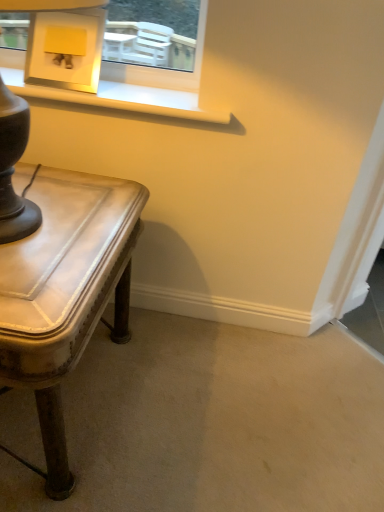
Locate an element on the screen. matte brown table lamp at left is located at coordinates (13, 169).

This screenshot has width=384, height=512. What do you see at coordinates (13, 169) in the screenshot?
I see `matte brown table lamp at left` at bounding box center [13, 169].

In order to click on leather-like table at lower left in this screenshot , I will do `click(65, 292)`.

The image size is (384, 512). What do you see at coordinates (65, 292) in the screenshot? I see `leather-like table at lower left` at bounding box center [65, 292].

This screenshot has width=384, height=512. What are the coordinates of `matte brown table lamp at left` in the screenshot? It's located at (13, 169).

Is leather-like table at lower left to the right of matte brown table lamp at left from the viewer's perspective?

In fact, leather-like table at lower left is to the left of matte brown table lamp at left.

In the image, is leather-like table at lower left positioned in front of or behind matte brown table lamp at left?

In the image, leather-like table at lower left appears behind matte brown table lamp at left.

Does point (42, 378) come in front of point (92, 20)?

Yes.

From the image's perspective, is leather-like table at lower left on matte brown table lamp at left?

Incorrect, from the image's perspective, leather-like table at lower left is lower than matte brown table lamp at left.

From a real-world perspective, between leather-like table at lower left and matte brown table lamp at left, who is vertically lower?

In real-world perspective, leather-like table at lower left is lower.

Considering the relative sizes of leather-like table at lower left and matte brown table lamp at left in the image provided, is leather-like table at lower left thinner than matte brown table lamp at left?

In fact, leather-like table at lower left might be wider than matte brown table lamp at left.

Considering the relative sizes of leather-like table at lower left and matte brown table lamp at left in the image provided, is leather-like table at lower left taller than matte brown table lamp at left?

Yes.

Does leather-like table at lower left have a smaller size compared to matte brown table lamp at left?

Incorrect, leather-like table at lower left is not smaller in size than matte brown table lamp at left.

Do you think leather-like table at lower left is within matte brown table lamp at left, or outside of it?

leather-like table at lower left is not inside matte brown table lamp at left, it's outside.

Would you consider leather-like table at lower left to be distant from matte brown table lamp at left?

They are positioned close to each other.

Could you tell me if leather-like table at lower left is turned towards matte brown table lamp at left?

No, leather-like table at lower left is not aimed at matte brown table lamp at left.

Can you tell me how much leather-like table at lower left and matte brown table lamp at left differ in facing direction?

The facing directions of leather-like table at lower left and matte brown table lamp at left are 7.09e-05 degrees apart.

Measure the distance from leather-like table at lower left to matte brown table lamp at left.

leather-like table at lower left and matte brown table lamp at left are 9.30 inches apart from each other.

At what (x,y) coordinates should I click in order to perform the action: click on table lamp lying on the right of leather-like table at lower left. Please return your answer as a coordinate pair (x, y). The height and width of the screenshot is (512, 384). Looking at the image, I should click on (13, 169).

Does matte brown table lamp at left appear on the right side of leather-like table at lower left?

Yes, matte brown table lamp at left is to the right of leather-like table at lower left.

Is matte brown table lamp at left in front of or behind leather-like table at lower left in the image?

In the image, matte brown table lamp at left appears in front of leather-like table at lower left.

Which is nearer, (x=13, y=154) or (x=118, y=215)?

The point (x=13, y=154) is more forward.

From the image's perspective, is matte brown table lamp at left above or below leather-like table at lower left?

matte brown table lamp at left is situated higher than leather-like table at lower left in the image.

From a real-world perspective, does matte brown table lamp at left sit lower than leather-like table at lower left?

No, from a real-world perspective, matte brown table lamp at left is not under leather-like table at lower left.

Does matte brown table lamp at left have a lesser width compared to leather-like table at lower left?

Yes, matte brown table lamp at left is thinner than leather-like table at lower left.

Between matte brown table lamp at left and leather-like table at lower left, which one has more height?

leather-like table at lower left is taller.

Consider the image. Looking at the image, does matte brown table lamp at left seem bigger or smaller compared to leather-like table at lower left?

matte brown table lamp at left is smaller than leather-like table at lower left.

Would you say matte brown table lamp at left is inside or outside leather-like table at lower left?

matte brown table lamp at left cannot be found inside leather-like table at lower left.

Are matte brown table lamp at left and leather-like table at lower left far apart?

Actually, matte brown table lamp at left and leather-like table at lower left are a little close together.

Could you tell me if matte brown table lamp at left is facing leather-like table at lower left?

No, matte brown table lamp at left does not turn towards leather-like table at lower left.

Measure the distance between matte brown table lamp at left and leather-like table at lower left.

matte brown table lamp at left and leather-like table at lower left are 23.61 centimeters apart from each other.

The height and width of the screenshot is (512, 384). Identify the location of table that is below the matte brown table lamp at left (from the image's perspective). (65, 292).

Find the location of a particular element. Image resolution: width=384 pixels, height=512 pixels. table lamp that is on the right side of leather-like table at lower left is located at coordinates (13, 169).

Find the location of a particular element. table lamp located in front of the leather-like table at lower left is located at coordinates (13, 169).